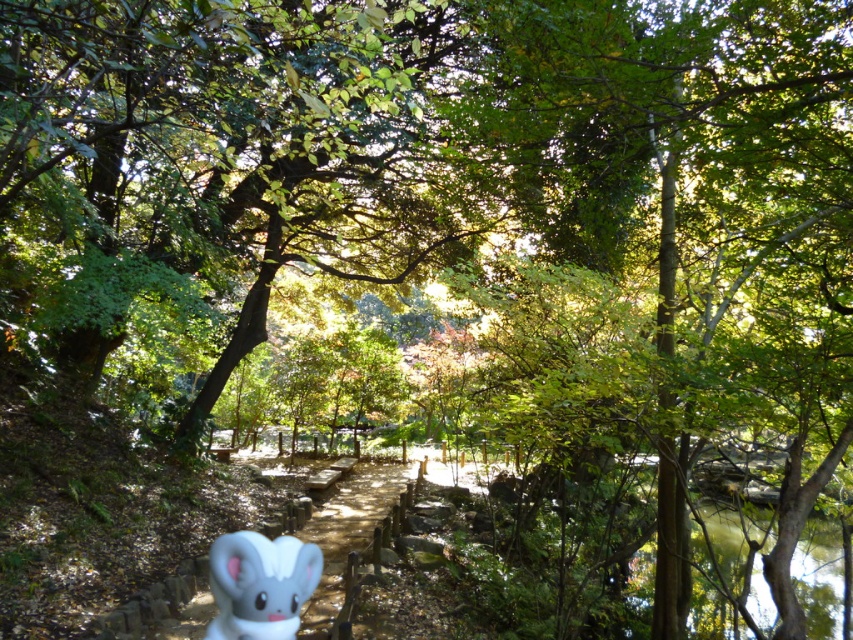
Is the position of wooden at center more distant than that of white matte bunny at lower center?

Yes.

Who is more forward, (x=183, y=630) or (x=258, y=595)?

Point (x=258, y=595) is in front.

The width and height of the screenshot is (853, 640). I want to click on wooden at center, so pos(349,529).